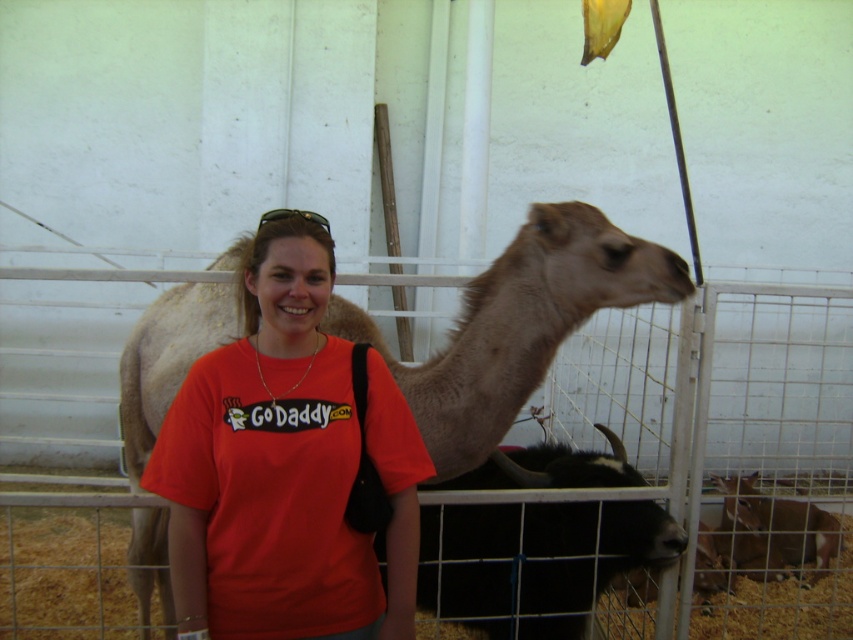
You are a zookeeper who needs to feed two animals in the enclosure. You have a bag of feed that can only be poured from a height of 1.5 meters. The light brown fur at center is a camel, and the brown furry goat at lower right is a goat. Can you pour feed over the fence to reach both animals without entering the enclosure?

The distance between the light brown fur at center and brown furry goat at lower right is 2.14 meters. Since the feed can only be poured from a height of 1.5 meters, the distance is too far to effectively reach both animals from outside the enclosure. You will need to enter the enclosure to feed them properly.

You are a wildlife photographer trying to capture a clear shot of the light brown fur at center and the brown furry goat at lower right. Which animal is located higher in the image?

The light brown fur at center is positioned over the brown furry goat at lower right, so the light brown fur at center is higher in the image.